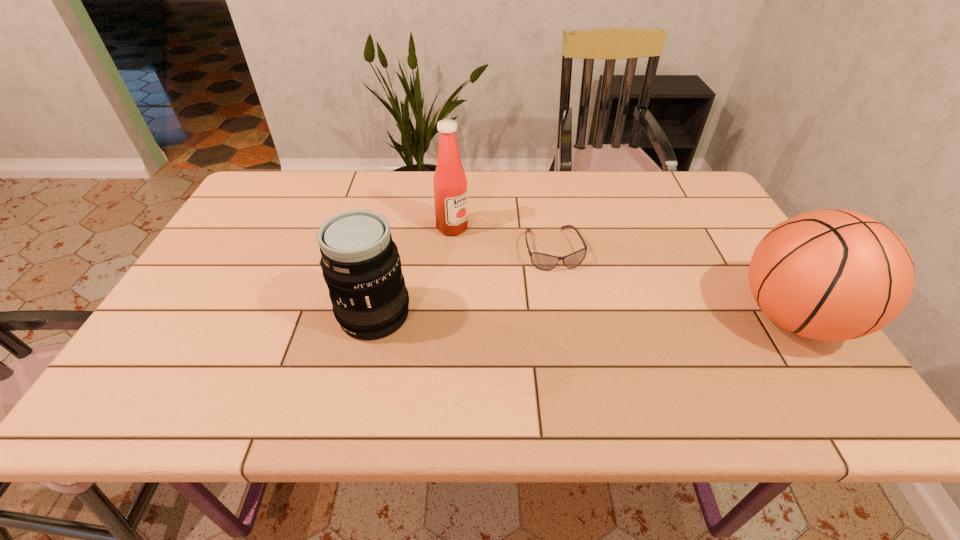
At what (x,y) coordinates should I click in order to perform the action: click on vacant space that's between the rightmost object and the third object from left to right. Please return your answer as a coordinate pair (x, y). This screenshot has width=960, height=540. Looking at the image, I should click on (673, 284).

This screenshot has height=540, width=960. Identify the location of blank region between the shortest object and the third object from right to left. (503, 239).

Image resolution: width=960 pixels, height=540 pixels. I want to click on blank region between the telephoto lens and the basketball, so click(584, 316).

You are a GUI agent. You are given a task and a screenshot of the screen. Output one action in this format:
    pyautogui.click(x=<x>, y=<y>)
    Task: Click on the vacant space in between the sunglasses and the basketball
    This screenshot has height=540, width=960.
    Given the screenshot: What is the action you would take?
    pyautogui.click(x=673, y=284)

The width and height of the screenshot is (960, 540). I want to click on free space between the rightmost object and the third object from right to left, so click(x=623, y=273).

Identify the location of free point between the basketball and the condiment. This screenshot has height=540, width=960. (623, 273).

Where is `empty space between the telephoto lens and the third object from right to left`? The height and width of the screenshot is (540, 960). empty space between the telephoto lens and the third object from right to left is located at coordinates (414, 271).

The image size is (960, 540). Identify the location of free space between the third object from right to left and the telephoto lens. (414, 271).

Identify the location of empty space that is in between the leftmost object and the second object from left to right. (414, 271).

Locate an element on the screen. free point between the third object from right to left and the rightmost object is located at coordinates (623, 273).